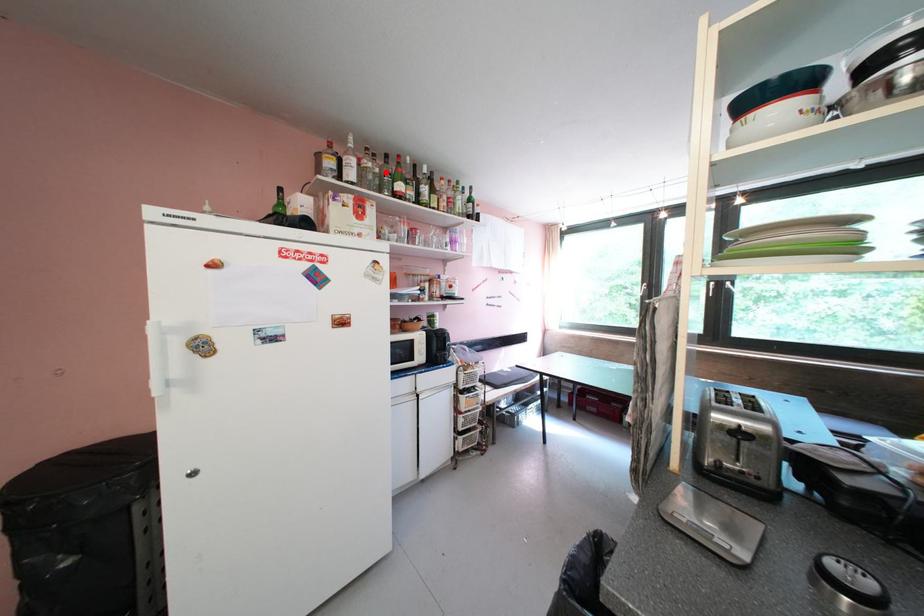
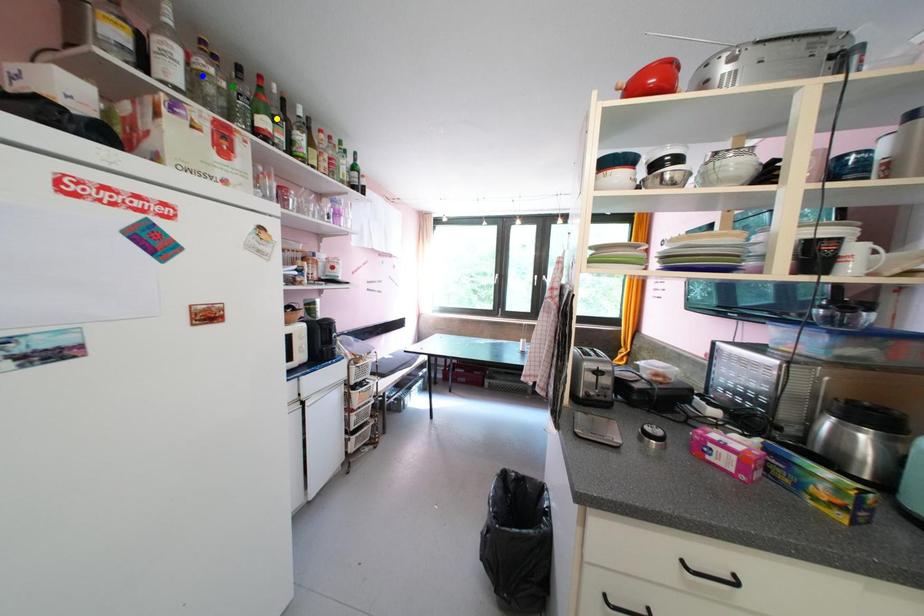
Question: I am providing you with two images of the same scene from different viewpoints. A red point is marked on the first image. You are given multiple points on the second image. Which point in image 2 represents the same 3d spot as the red point in image 1?

Choices:
 (A) green point
 (B) blue point
 (C) yellow point

Answer: (A)